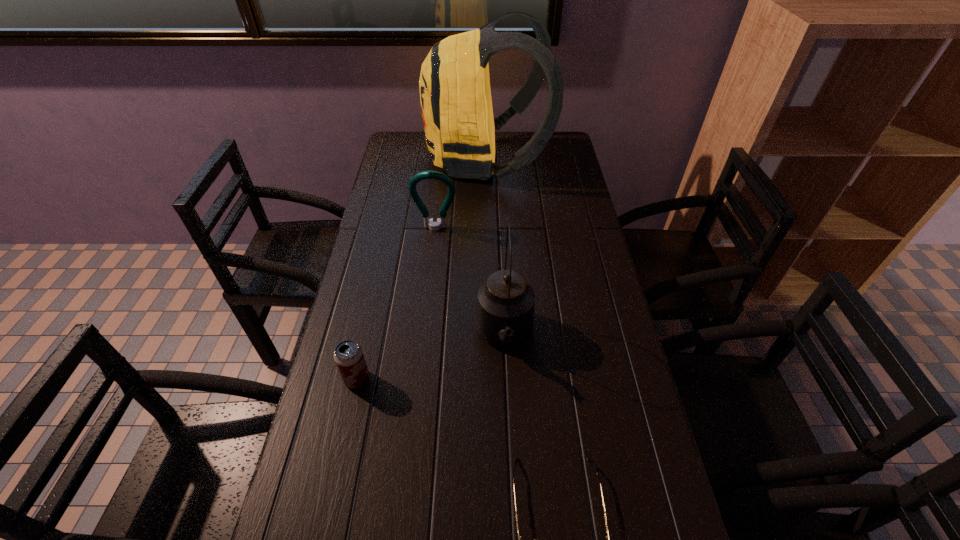
Image resolution: width=960 pixels, height=540 pixels. In order to click on the farthest object in this screenshot , I will do `click(455, 95)`.

The height and width of the screenshot is (540, 960). I want to click on backpack, so click(x=455, y=95).

Identify the location of kettle. This screenshot has height=540, width=960. (505, 307).

Identify the location of bottle opener. This screenshot has height=540, width=960. pyautogui.click(x=441, y=222).

This screenshot has height=540, width=960. In order to click on the third tallest object in this screenshot , I will do `click(441, 222)`.

Find the location of `beer can`. beer can is located at coordinates (348, 355).

What are the coordinates of `the leftmost object` in the screenshot? It's located at (348, 355).

Find the location of `free point located on the front-facing side of the backpack`. free point located on the front-facing side of the backpack is located at coordinates (386, 160).

The width and height of the screenshot is (960, 540). In order to click on vacant area situated on the front-facing side of the backpack in this screenshot , I will do `click(408, 160)`.

Locate an element on the screen. This screenshot has height=540, width=960. vacant space located on the front-facing side of the backpack is located at coordinates (398, 160).